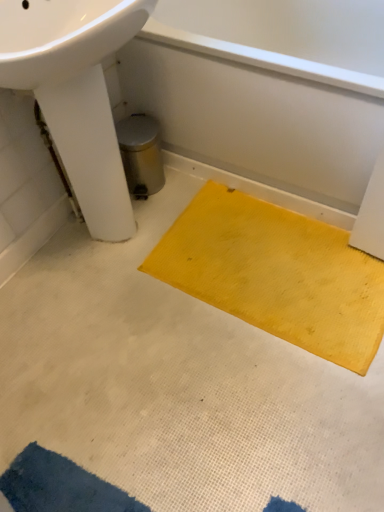
Question: From a real-world perspective, is white glossy sink at upper left beneath yellow rubber mat at center, which ranks as the second doormat in front-to-back order?

Choices:
 (A) no
 (B) yes

Answer: (A)

Question: Is white glossy sink at upper left outside of yellow rubber mat at center, the second doormat from the left?

Choices:
 (A) yes
 (B) no

Answer: (A)

Question: Is white glossy sink at upper left next to yellow rubber mat at center, the 1th doormat viewed from the top?

Choices:
 (A) yes
 (B) no

Answer: (B)

Question: From the image's perspective, is white glossy sink at upper left located above yellow rubber mat at center, arranged as the 1th doormat when viewed from the right?

Choices:
 (A) no
 (B) yes

Answer: (B)

Question: Considering the relative sizes of white glossy sink at upper left and yellow rubber mat at center, the 1th doormat viewed from the top, in the image provided, is white glossy sink at upper left smaller than yellow rubber mat at center, the 1th doormat viewed from the top,?

Choices:
 (A) no
 (B) yes

Answer: (A)

Question: Considering the positions of point (362, 184) and point (71, 177), is point (362, 184) closer or farther from the camera than point (71, 177)?

Choices:
 (A) farther
 (B) closer

Answer: (B)

Question: Which is correct: yellow rubber mat at lower right is inside white glossy sink at upper left, or outside of it?

Choices:
 (A) inside
 (B) outside

Answer: (B)

Question: Relative to white glossy sink at upper left, is yellow rubber mat at lower right in front or behind?

Choices:
 (A) front
 (B) behind

Answer: (B)

Question: Based on their positions, is yellow rubber mat at lower right located to the left or right of white glossy sink at upper left?

Choices:
 (A) right
 (B) left

Answer: (A)

Question: Is yellow rubber mat at lower right taller or shorter than yellow rubber mat at center, which is the second doormat from bottom to top?

Choices:
 (A) tall
 (B) short

Answer: (A)

Question: From a real-world perspective, is yellow rubber mat at lower right positioned above or below yellow rubber mat at center, the 1th doormat viewed from the top?

Choices:
 (A) above
 (B) below

Answer: (A)

Question: Does point (311, 67) appear closer or farther from the camera than point (274, 206)?

Choices:
 (A) closer
 (B) farther

Answer: (A)

Question: Relative to yellow rubber mat at center, which ranks as the second doormat in front-to-back order, is yellow rubber mat at lower right in front or behind?

Choices:
 (A) behind
 (B) front

Answer: (B)

Question: From their relative heights in the image, would you say white glossy sink at upper left is taller or shorter than yellow rubber mat at center, the 1th doormat in the back-to-front sequence?

Choices:
 (A) tall
 (B) short

Answer: (A)

Question: Is white glossy sink at upper left inside the boundaries of yellow rubber mat at center, the 1th doormat viewed from the top, or outside?

Choices:
 (A) outside
 (B) inside

Answer: (A)